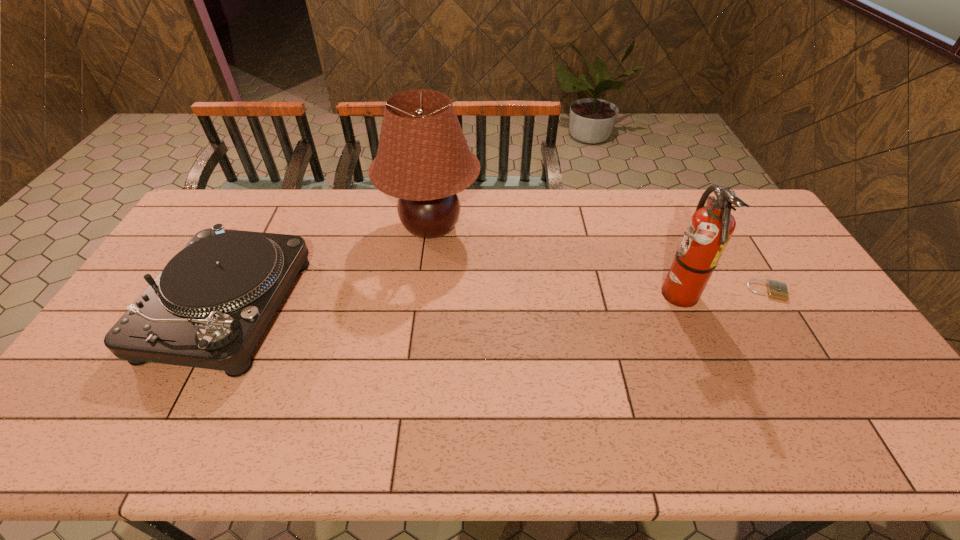
You are a GUI agent. You are given a task and a screenshot of the screen. Output one action in this format:
    pyautogui.click(x=<x>, y=<y>)
    Task: Click on the vacant space situated on the left of the third tallest object
    
    Given the screenshot: What is the action you would take?
    pyautogui.click(x=135, y=308)

The width and height of the screenshot is (960, 540). I want to click on vacant space situated 0.170m on the back of the padlock, so click(x=739, y=244).

The image size is (960, 540). Find the location of `object that is at the far edge`. object that is at the far edge is located at coordinates (423, 159).

The height and width of the screenshot is (540, 960). What are the coordinates of `object that is positioned at the left edge` in the screenshot? It's located at (208, 308).

Where is `object positioned at the right edge`? Image resolution: width=960 pixels, height=540 pixels. object positioned at the right edge is located at coordinates (778, 290).

This screenshot has height=540, width=960. I want to click on vacant position at the far edge of the desktop, so click(561, 224).

In the image, there is a desktop. Where is `free space at the near edge`? The image size is (960, 540). free space at the near edge is located at coordinates point(454,446).

In the image, there is a desktop. Where is `free region at the right edge`? free region at the right edge is located at coordinates (794, 334).

The height and width of the screenshot is (540, 960). What are the coordinates of `unoccupied area between the padlock and the fire extinguisher` in the screenshot? It's located at (721, 293).

Find the location of a particular element. free space between the third object from right to left and the padlock is located at coordinates (599, 259).